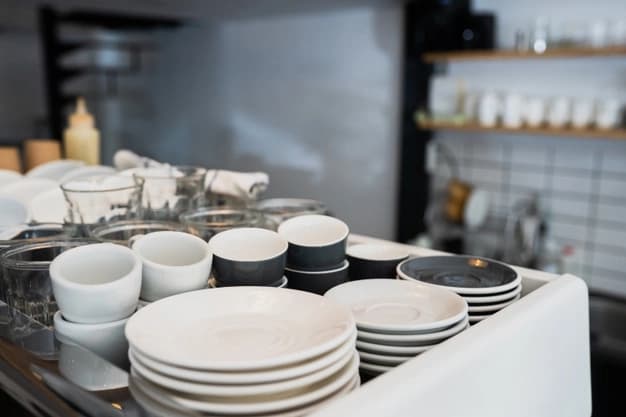
Where is `bowl`? bowl is located at coordinates (14, 218), (33, 188), (9, 176), (54, 168), (54, 205), (98, 168), (140, 172).